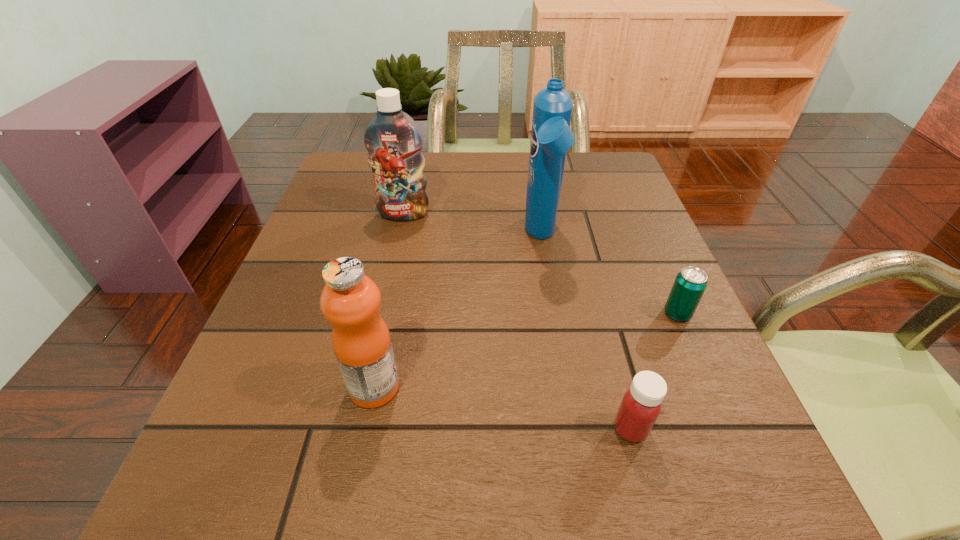
Locate an element on the screen. free region located 0.310m on the left of the medicine is located at coordinates (401, 429).

The image size is (960, 540). I want to click on vacant space located on the back of the shortest object, so click(x=623, y=190).

At what (x,y) coordinates should I click in order to perform the action: click on object that is at the left edge. Please return your answer as a coordinate pair (x, y). This screenshot has width=960, height=540. Looking at the image, I should click on (394, 142).

What are the coordinates of `medicine positioned at the right edge` in the screenshot? It's located at (641, 404).

This screenshot has height=540, width=960. I want to click on beer can present at the right edge, so click(688, 288).

The height and width of the screenshot is (540, 960). Find the location of `vacant space at the far edge`. vacant space at the far edge is located at coordinates (486, 186).

This screenshot has height=540, width=960. In order to click on vacant position at the near edge of the desktop in this screenshot , I will do `click(490, 518)`.

You are a GUI agent. You are given a task and a screenshot of the screen. Output one action in this format:
    pyautogui.click(x=<x>, y=<y>)
    Task: Click on the vacant space at the left edge
    This screenshot has width=960, height=540.
    Given the screenshot: What is the action you would take?
    pyautogui.click(x=332, y=226)

The height and width of the screenshot is (540, 960). In the image, there is a desktop. Identify the location of vacant space at the right edge. (747, 459).

Find the location of a particular element. This screenshot has width=960, height=540. free space at the far left corner of the desktop is located at coordinates (348, 155).